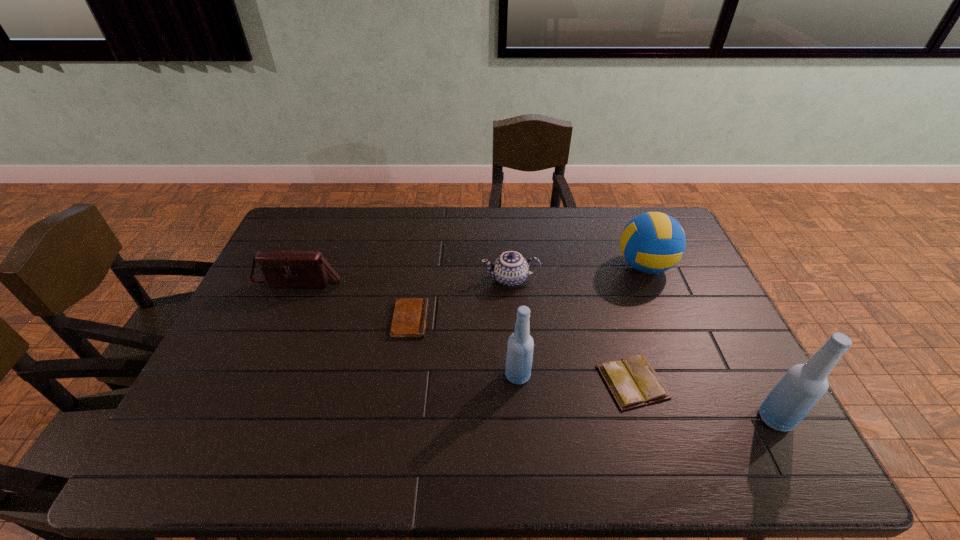
The image size is (960, 540). Find the location of `object that stands as the fourth closest to the fourth farthest object`. object that stands as the fourth closest to the fourth farthest object is located at coordinates (633, 382).

Locate an element on the screen. This screenshot has width=960, height=540. vacant space that satisfies the following two spatial constraints: 1. on the spine side of the fourth farthest object; 2. on the left side of the right diary is located at coordinates (400, 382).

You are a GUI agent. You are given a task and a screenshot of the screen. Output one action in this format:
    pyautogui.click(x=<x>, y=<y>)
    Task: Click on the free spot that satisfies the following two spatial constraints: 1. on the front flap of the fourth tallest object; 2. on the left side of the nearer diary
    The width and height of the screenshot is (960, 540).
    Given the screenshot: What is the action you would take?
    pyautogui.click(x=257, y=382)

Where is `free location that satisfies the following two spatial constraints: 1. on the back side of the nearer diary; 2. on the spine side of the sixth object from right to left`? Image resolution: width=960 pixels, height=540 pixels. free location that satisfies the following two spatial constraints: 1. on the back side of the nearer diary; 2. on the spine side of the sixth object from right to left is located at coordinates (614, 319).

Image resolution: width=960 pixels, height=540 pixels. I want to click on vacant space that satisfies the following two spatial constraints: 1. on the back side of the tallest object; 2. from the spout of the third shortest object, so click(701, 279).

Where is `vacant space that satisfies the following two spatial constraints: 1. on the spine side of the farther bottle; 2. on the right side of the left diary`? This screenshot has width=960, height=540. vacant space that satisfies the following two spatial constraints: 1. on the spine side of the farther bottle; 2. on the right side of the left diary is located at coordinates (401, 375).

Find the location of a particular element. The height and width of the screenshot is (540, 960). vacant area in the image that satisfies the following two spatial constraints: 1. from the spout of the fifth tallest object; 2. on the back side of the right diary is located at coordinates (518, 382).

Where is `free region that satisfies the following two spatial constraints: 1. on the spine side of the shorter bottle; 2. on the left side of the farther diary`? free region that satisfies the following two spatial constraints: 1. on the spine side of the shorter bottle; 2. on the left side of the farther diary is located at coordinates (401, 375).